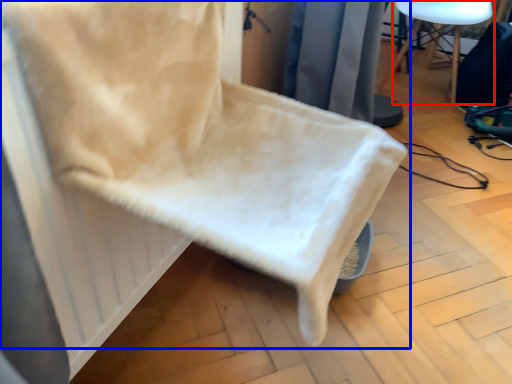
Question: Which object is closer to the camera taking this photo, furniture (highlighted by a red box) or chair (highlighted by a blue box)?

Choices:
 (A) furniture
 (B) chair

Answer: (B)